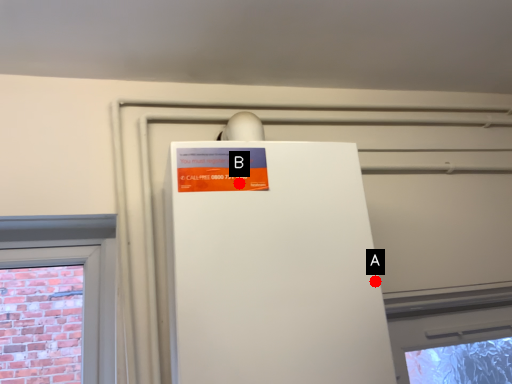
Question: Two points are circled on the image, labeled by A and B beside each circle. Which point is farther from the camera taking this photo?

Choices:
 (A) A is further
 (B) B is further

Answer: (A)